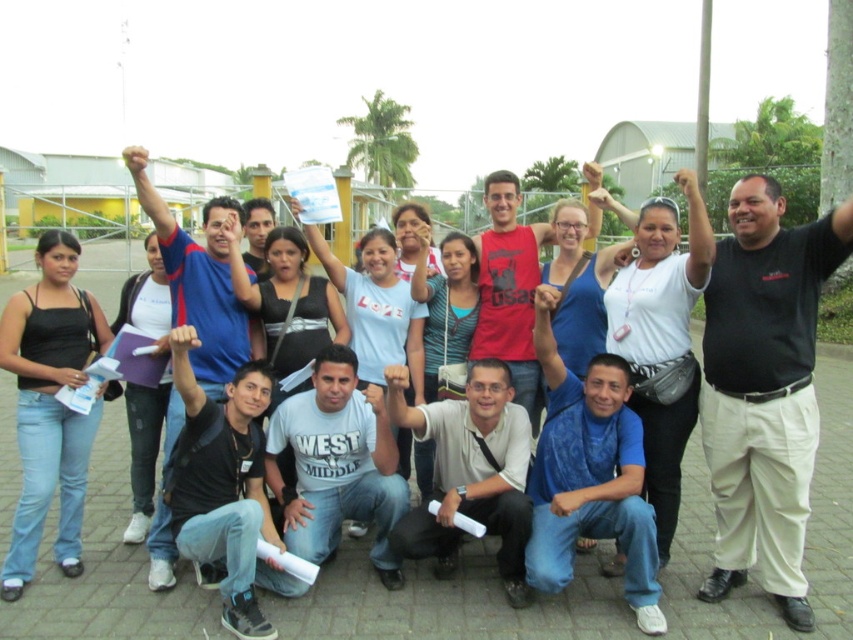
Question: Is black matte shirt at center below white matte shirt at center?

Choices:
 (A) yes
 (B) no

Answer: (B)

Question: Is blue fabric shirt at upper center bigger than matte red tank top at center?

Choices:
 (A) yes
 (B) no

Answer: (A)

Question: Which of the following is the closest to the observer?

Choices:
 (A) blue fabric shirt at upper center
 (B) white cotton shirt at center
 (C) matte red tank top at center

Answer: (A)

Question: Can you confirm if black matte shirt at center is bigger than matte red tank top at center?

Choices:
 (A) yes
 (B) no

Answer: (B)

Question: Among these objects, which one is nearest to the camera?

Choices:
 (A) blue cotton shirt at center
 (B) matte red tank top at center

Answer: (A)

Question: Which point appears closest to the camera in this image?

Choices:
 (A) (256, 563)
 (B) (440, 496)
 (C) (183, 508)
 (D) (508, 280)

Answer: (C)